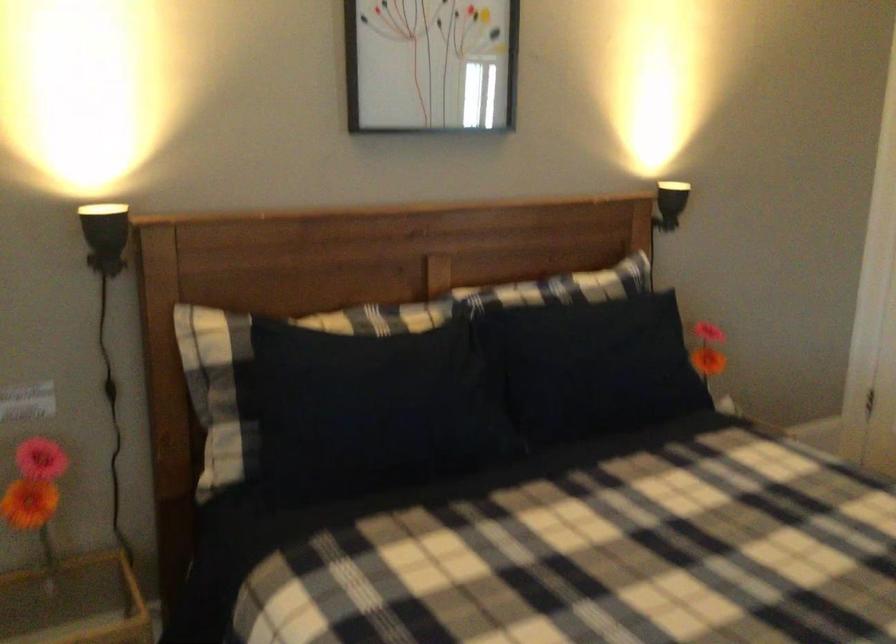
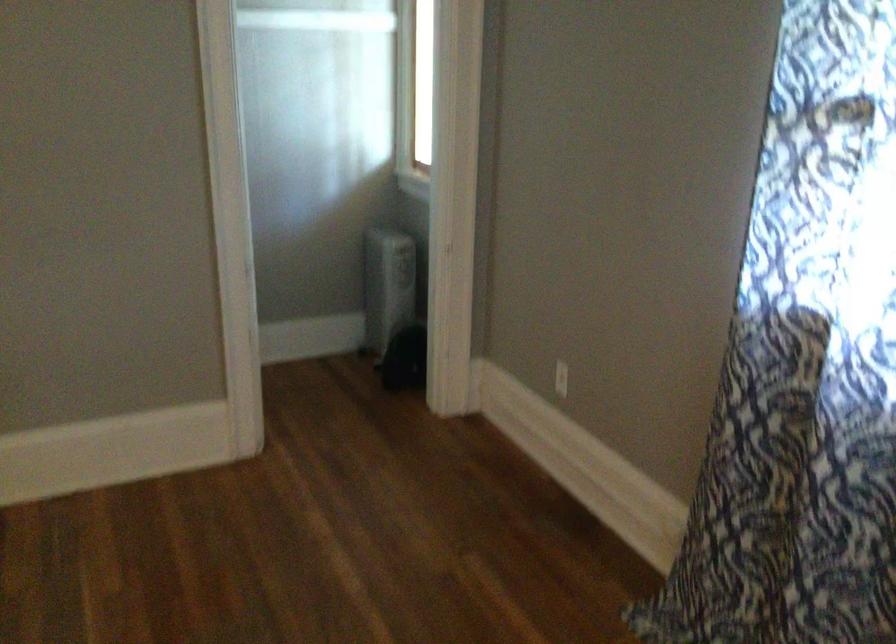
Based on the continuous images, in which direction is the camera rotating?

The camera rotated toward right-down.